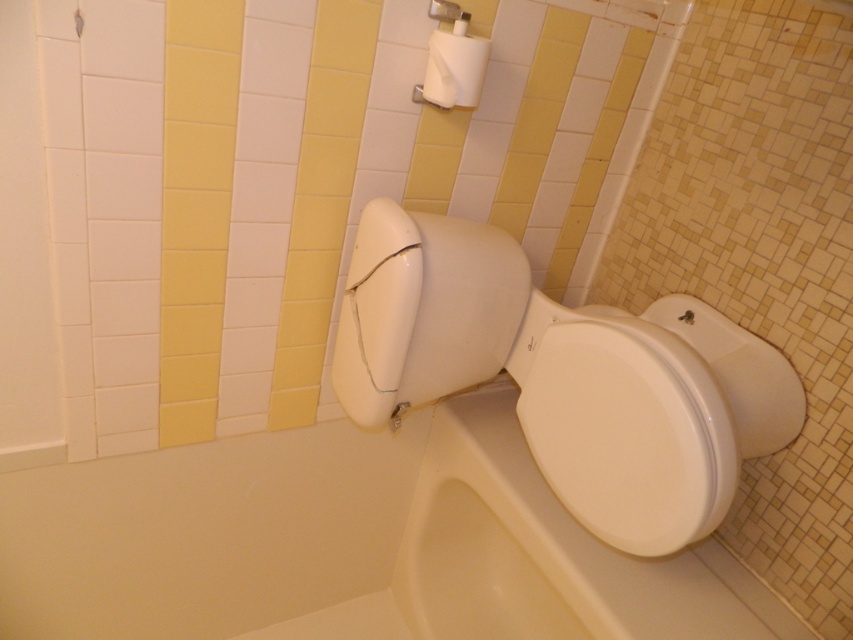
In the scene shown: Can you confirm if white glossy toilet bowl at center is bigger than white matte toilet paper at upper center?

Correct, white glossy toilet bowl at center is larger in size than white matte toilet paper at upper center.

Who is shorter, white glossy toilet bowl at center or white matte toilet paper at upper center?

white matte toilet paper at upper center is shorter.

Identify the location of white glossy toilet bowl at center. (564, 376).

Is white glossy bathtub at lower left to the left of white glossy toilet bowl at center from the viewer's perspective?

Answer: Indeed, white glossy bathtub at lower left is positioned on the left side of white glossy toilet bowl at center.

Which is behind, point (173, 588) or point (550, 304)?

Point (173, 588)

This screenshot has height=640, width=853. What do you see at coordinates (347, 545) in the screenshot?
I see `white glossy bathtub at lower left` at bounding box center [347, 545].

The height and width of the screenshot is (640, 853). I want to click on white glossy bathtub at lower left, so click(x=347, y=545).

Find the location of a particular element. The height and width of the screenshot is (640, 853). white glossy bathtub at lower left is located at coordinates (347, 545).

Find the location of a particular element. The height and width of the screenshot is (640, 853). white glossy bathtub at lower left is located at coordinates (347, 545).